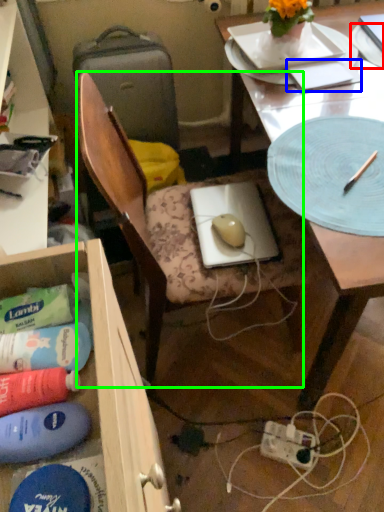
Question: Which object is the farthest from paper plate (highlighted by a red box)? Choose among these: notepad (highlighted by a blue box) or chair (highlighted by a green box).

Choices:
 (A) notepad
 (B) chair

Answer: (B)